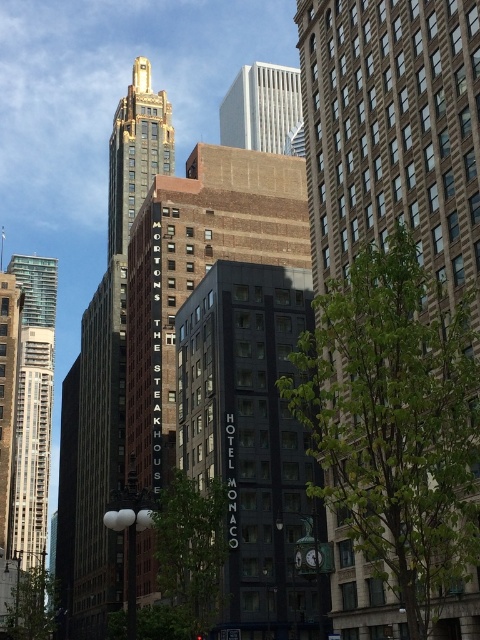
Which is behind, point (321, 280) or point (290, 129)?

The point (290, 129) is more distant.

Locate an element on the screen. The width and height of the screenshot is (480, 640). brown brick building at center is located at coordinates (392, 131).

Find the location of `brown brick building at center`. brown brick building at center is located at coordinates (392, 131).

Where is `brown brick building at center`? The height and width of the screenshot is (640, 480). brown brick building at center is located at coordinates (392, 131).

Is black glass building at center to the right of shiny gold tower at upper center from the viewer's perspective?

Indeed, black glass building at center is positioned on the right side of shiny gold tower at upper center.

Who is lower down, black glass building at center or shiny gold tower at upper center?

Positioned lower is black glass building at center.

The width and height of the screenshot is (480, 640). What do you see at coordinates (253, 445) in the screenshot?
I see `black glass building at center` at bounding box center [253, 445].

Locate an element on the screen. The height and width of the screenshot is (640, 480). black glass building at center is located at coordinates (253, 445).

Who is taller, brown brick building at center or black glass building at center?

brown brick building at center is taller.

Does brown brick building at center lie behind black glass building at center?

No, it is not.

Identify the location of brown brick building at center. (392, 131).

Image resolution: width=480 pixels, height=640 pixels. Identify the location of brown brick building at center. (392, 131).